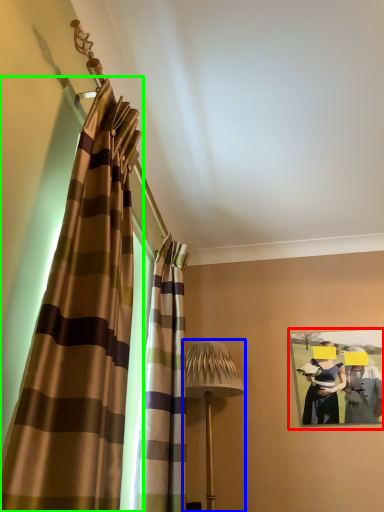
Question: Which is farther away from picture frame (highlighted by a red box)? table lamp (highlighted by a blue box) or curtain (highlighted by a green box)?

Choices:
 (A) table lamp
 (B) curtain

Answer: (B)